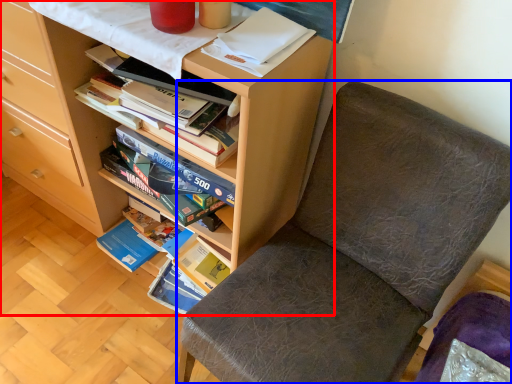
Question: Which of the following is the closest to the observer, bookcase (highlighted by a red box) or chair (highlighted by a blue box)?

Choices:
 (A) bookcase
 (B) chair

Answer: (B)